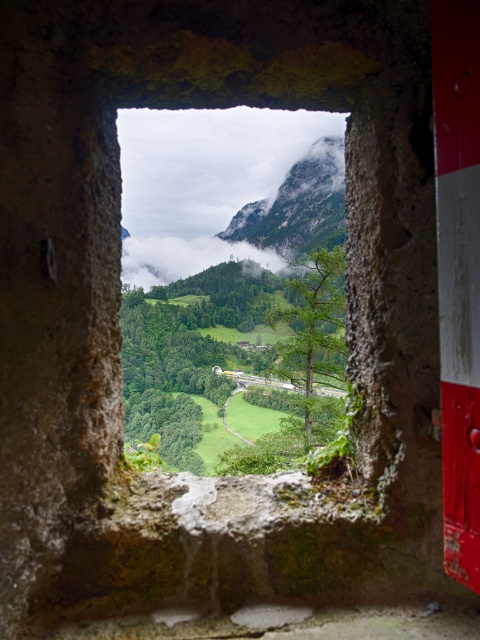
Is transparent glass window at center above green grassy mountain at center?

Incorrect, transparent glass window at center is not positioned above green grassy mountain at center.

Between transparent glass window at center and green grassy mountain at center, which one has less height?

green grassy mountain at center is shorter.

In the scene shown: Measure the distance between point [123,125] and camera.

The distance of point [123,125] from camera is 33.67 meters.

In order to click on transparent glass window at center in this screenshot , I will do `click(204, 180)`.